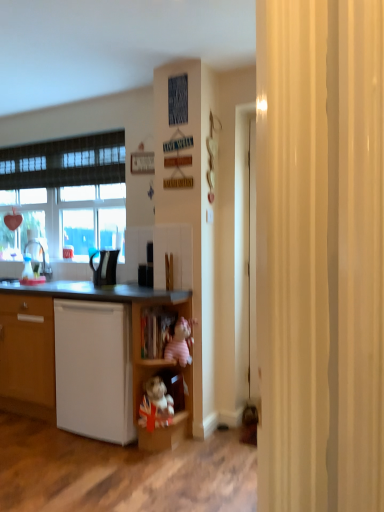
You are a GUI agent. You are given a task and a screenshot of the screen. Output one action in this format:
    pyautogui.click(x=<x>, y=<y>)
    Task: Click on the free space to the left of white matte cupboard at lower left
    
    Given the screenshot: What is the action you would take?
    pyautogui.click(x=38, y=439)